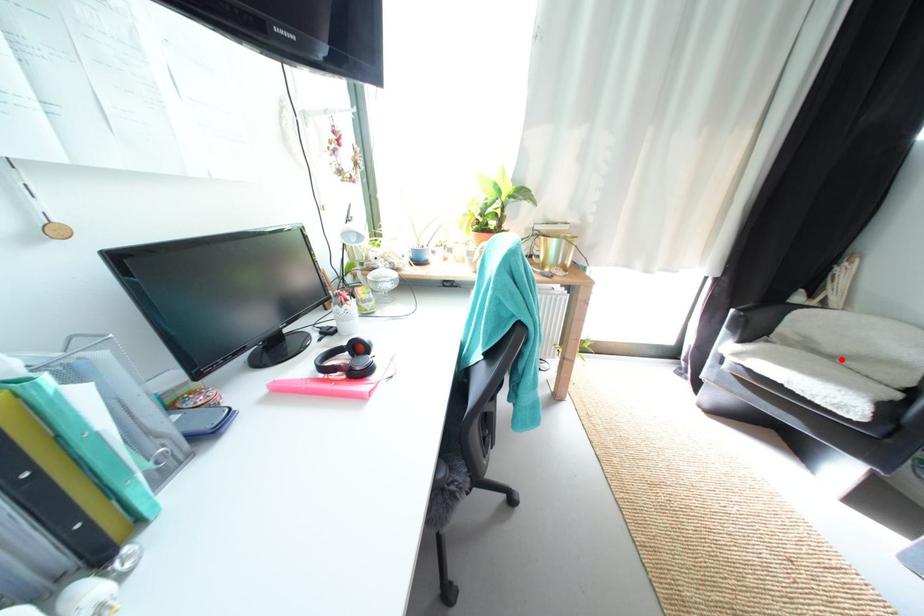
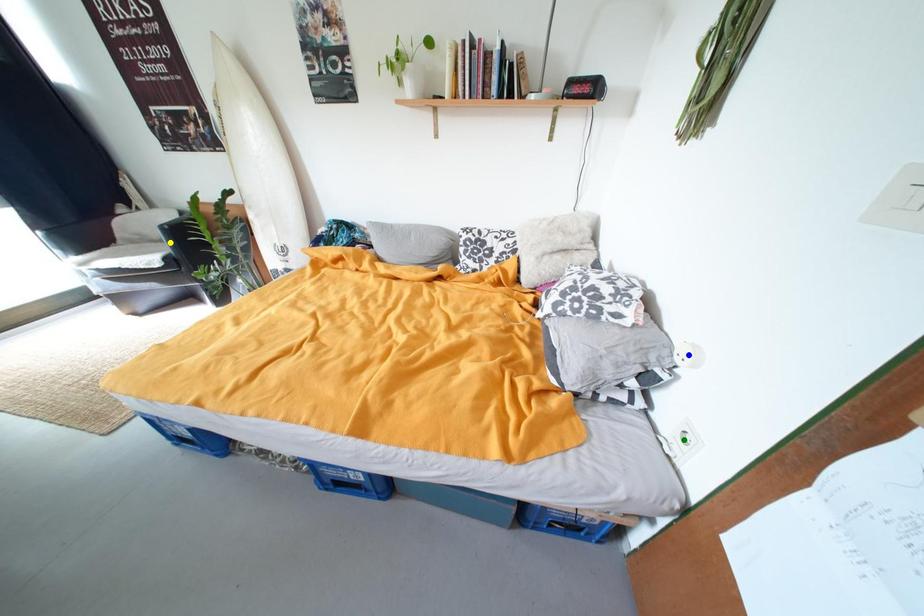
Question: I am providing you with two images of the same scene from different viewpoints. A red point is marked on the first image. You are given multiple points on the second image. Which spot in image 2 lines up with the point in image 1?

Choices:
 (A) green point
 (B) yellow point
 (C) blue point

Answer: (B)